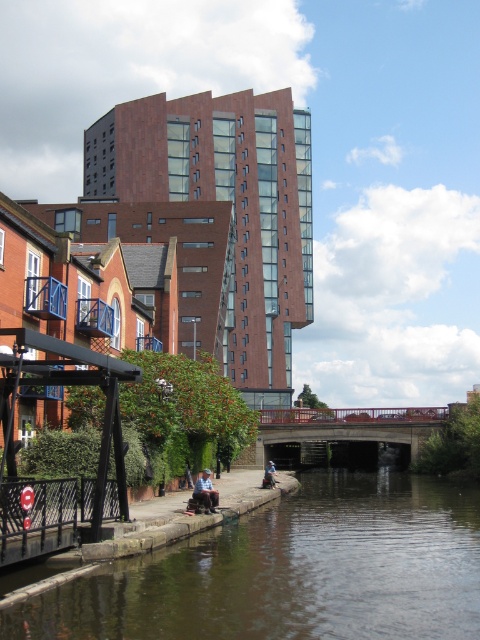
You are standing at the point labeled point [292,570] on the brown stone river at lower center. Which direction should you walk to reach the modern high rise building with red brick and glass panels in the background?

You should walk north to reach the modern high rise building with red brick and glass panels in the background because the point is located at the lower center of the brown stone river, which is in the foreground, and the building is in the background, typically north in such orientations.

You are standing on the riverside walkway and see the blue denim jeans at lower center and the denim jacket at lower center. Which item is positioned higher relative to the other?

The blue denim jeans at lower center is located above the denim jacket at lower center, so the blue denim jeans at lower center is positioned higher than the denim jacket at lower center.